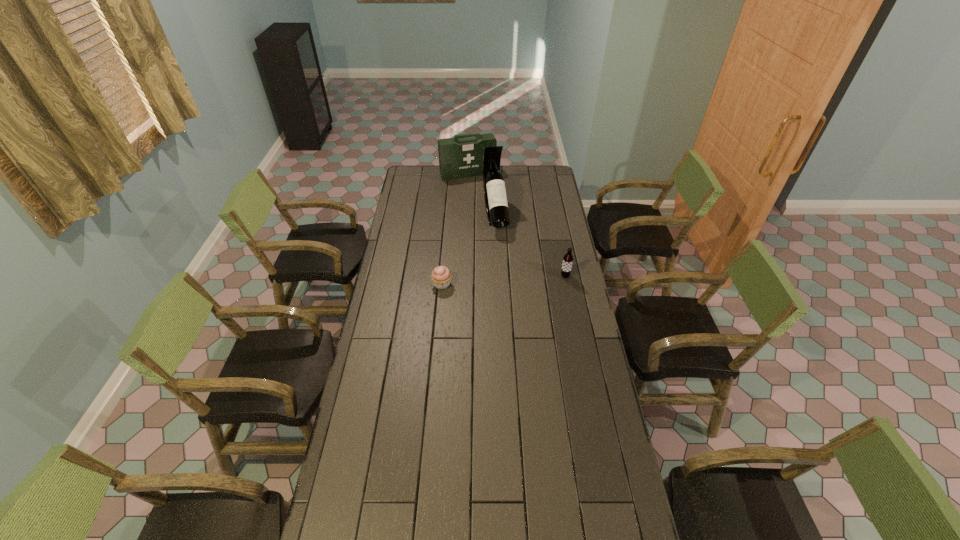
You are a GUI agent. You are given a task and a screenshot of the screen. Output one action in this format:
    pyautogui.click(x=<x>, y=<y>)
    Task: Click on the free space at the right edge
    The width and height of the screenshot is (960, 540).
    Given the screenshot: What is the action you would take?
    pyautogui.click(x=566, y=305)

Identify the location of vacant space at the far left corner. This screenshot has height=540, width=960. 413,181.

The height and width of the screenshot is (540, 960). What are the coordinates of `vacant space in between the shortest object and the farthest object` in the screenshot? It's located at click(x=455, y=229).

Where is `vacant space that is in between the root beer and the third shortest object`? The image size is (960, 540). vacant space that is in between the root beer and the third shortest object is located at coordinates (516, 225).

This screenshot has height=540, width=960. Identify the location of empty space between the farthest object and the root beer. (516, 225).

In order to click on free space between the wine bottle and the second tallest object in this screenshot , I will do `click(482, 194)`.

Locate an element on the screen. vacant space that's between the second shortest object and the first-aid kit is located at coordinates (516, 225).

Where is `empty space that is in between the wine bottle and the cupcake`? empty space that is in between the wine bottle and the cupcake is located at coordinates (468, 249).

I want to click on unoccupied position between the cupcake and the farthest object, so click(x=455, y=229).

Find the location of a particular element. Image resolution: width=960 pixels, height=540 pixels. unoccupied position between the shortest object and the tallest object is located at coordinates (468, 249).